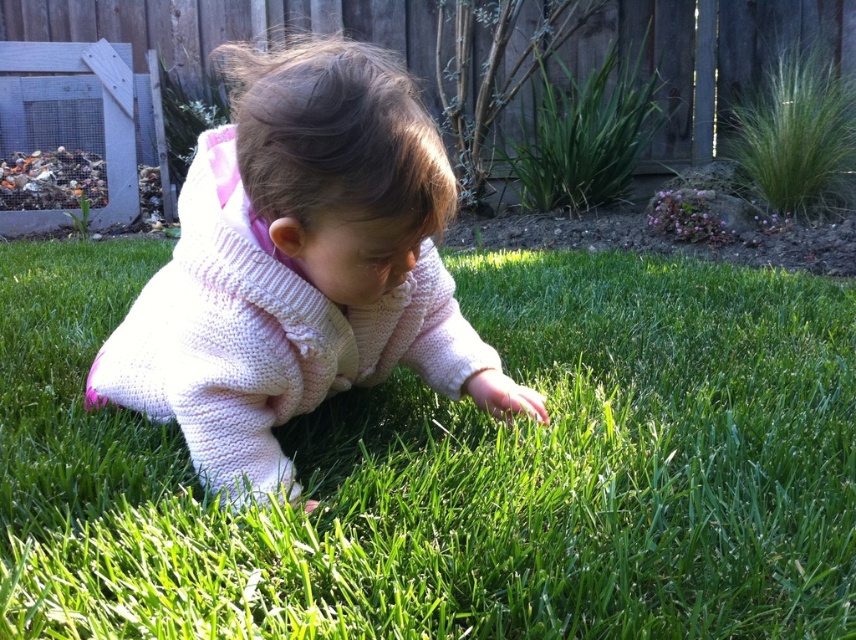
Question: Where is green grass at center located in relation to knitted pink sweater at center in the image?

Choices:
 (A) above
 (B) below

Answer: (A)

Question: Does green grass at center have a larger size compared to knitted pink sweater at center?

Choices:
 (A) no
 (B) yes

Answer: (B)

Question: Among these objects, which one is nearest to the camera?

Choices:
 (A) knitted pink sweater at center
 (B) green grass at center

Answer: (B)

Question: Is green grass at center above knitted pink sweater at center?

Choices:
 (A) no
 (B) yes

Answer: (B)